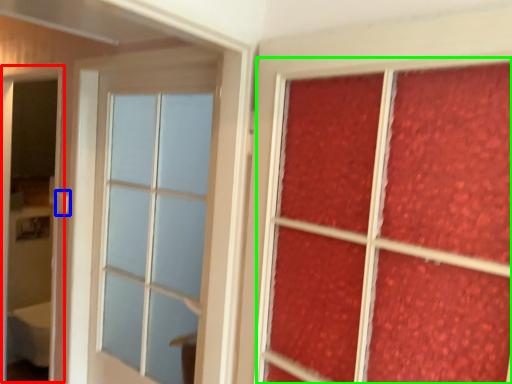
Question: Estimate the real-world distances between objects in this image. Which object is farther from screen door (highlighted by a red box), door handle (highlighted by a blue box) or bay window (highlighted by a green box)?

Choices:
 (A) door handle
 (B) bay window

Answer: (B)